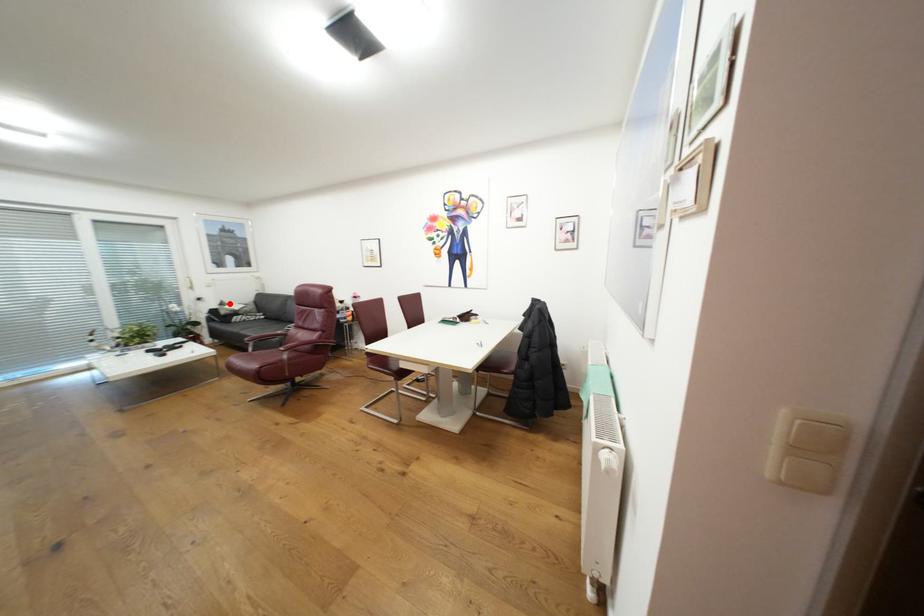
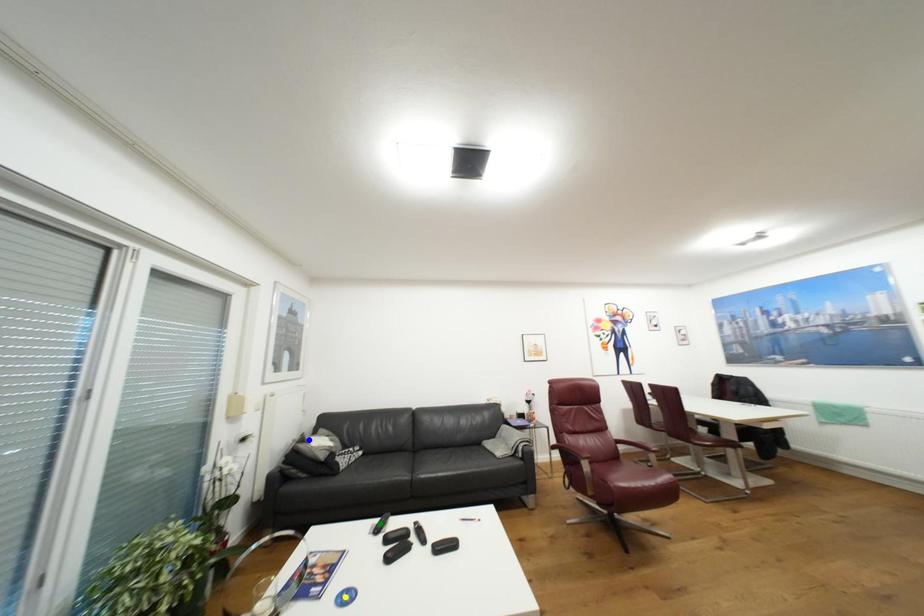
Question: I am providing you with two images of the same scene from different viewpoints. A red point is marked on the first image. You are given multiple points on the second image. Which point in image 2 represents the same 3d spot as the red point in image 1?

Choices:
 (A) green point
 (B) blue point
 (C) yellow point

Answer: (B)